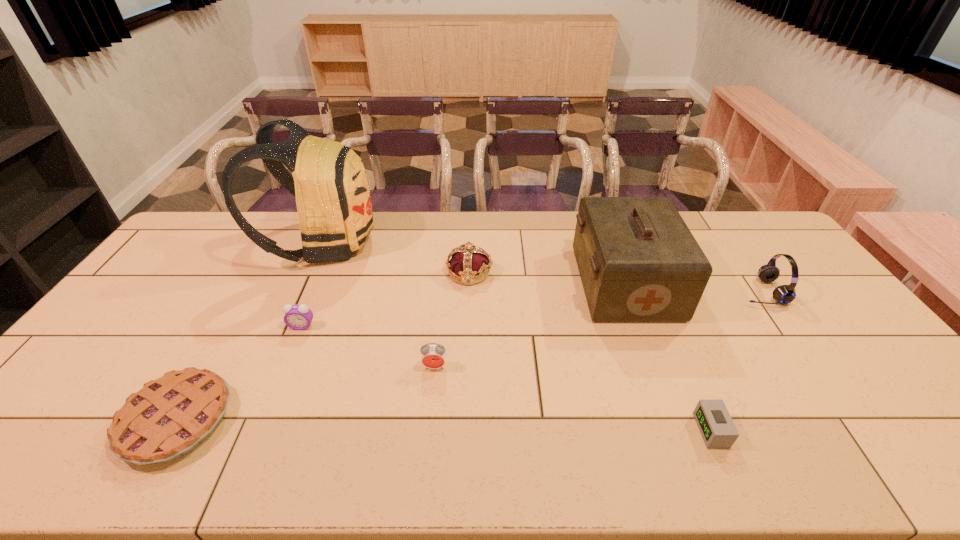
Where is `backpack`? The height and width of the screenshot is (540, 960). backpack is located at coordinates (329, 181).

Find the location of a particular element. This screenshot has width=960, height=540. the seventh shortest object is located at coordinates (638, 261).

Find the location of a particular element. This screenshot has height=540, width=960. headset is located at coordinates (784, 294).

The height and width of the screenshot is (540, 960). Identify the location of crown. (467, 261).

Where is `the second alarm clock from left to right`? Image resolution: width=960 pixels, height=540 pixels. the second alarm clock from left to right is located at coordinates (433, 355).

Where is `the tallest alarm clock`? the tallest alarm clock is located at coordinates (433, 355).

Locate an element on the screen. the leftmost alarm clock is located at coordinates click(x=298, y=317).

This screenshot has height=540, width=960. I want to click on the second shortest alarm clock, so click(298, 317).

This screenshot has width=960, height=540. I want to click on the nearest alarm clock, so click(717, 428).

Locate an element on the screen. the shortest alarm clock is located at coordinates (717, 428).